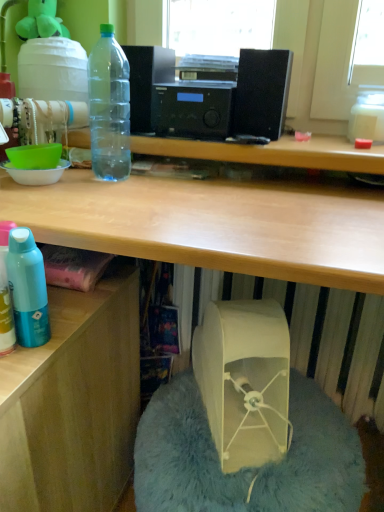
This screenshot has width=384, height=512. In order to click on vacant space in front of beige fabric bag at lower center in this screenshot , I will do `click(244, 475)`.